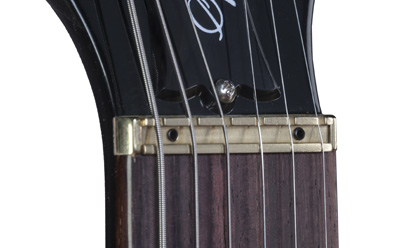
Identify the location of small black screws. This screenshot has height=248, width=398. (299, 135), (175, 136).